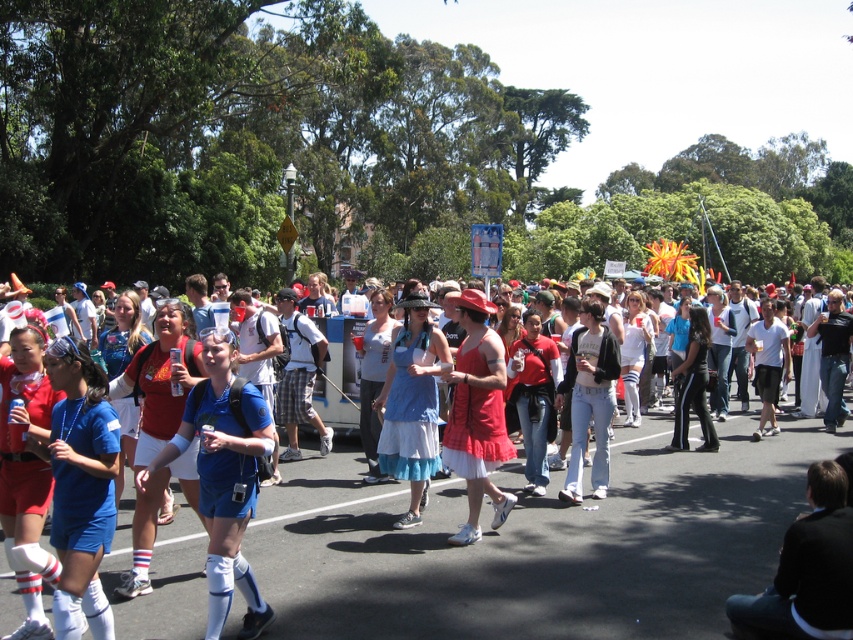
Which is above, blue fabric dress at center or matte red dress at center?

matte red dress at center

In the scene shown: Does blue fabric dress at center appear over matte red dress at center?

No, blue fabric dress at center is not above matte red dress at center.

The image size is (853, 640). I want to click on blue fabric dress at center, so click(537, 541).

I want to click on blue fabric dress at center, so click(x=537, y=541).

Does blue fabric dress at center appear under blue cotton dress at center?

Yes.

The image size is (853, 640). Describe the element at coordinates (537, 541) in the screenshot. I see `blue fabric dress at center` at that location.

At what (x,y) coordinates should I click in order to perform the action: click on blue fabric dress at center. Please return your answer as a coordinate pair (x, y). Looking at the image, I should click on (537, 541).

Can you confirm if matte red dress at center is thinner than blue cotton dress at center?

Correct, matte red dress at center's width is less than blue cotton dress at center's.

Is point (473, 385) farther from viewer compared to point (407, 422)?

No, (473, 385) is closer to viewer.

What do you see at coordinates (477, 413) in the screenshot? I see `matte red dress at center` at bounding box center [477, 413].

Locate an element on the screen. matte red dress at center is located at coordinates (477, 413).